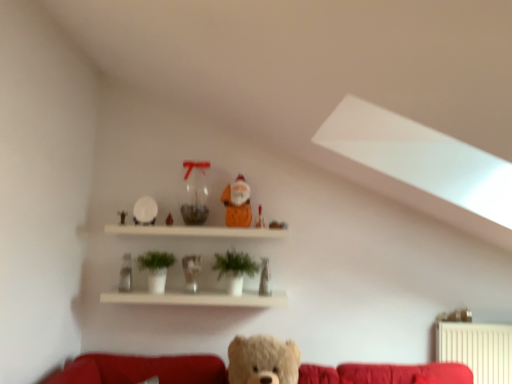
Question: Is translucent glass figurine at center, which ranks as the first figurine in left-to-right order, at the back of green matte plant at center?

Choices:
 (A) yes
 (B) no

Answer: (B)

Question: Is green matte plant at center not within translucent glass figurine at center, which ranks as the first figurine in left-to-right order?

Choices:
 (A) no
 (B) yes

Answer: (B)

Question: Is green matte plant at center smaller than translucent glass figurine at center, which ranks as the first figurine in left-to-right order?

Choices:
 (A) yes
 (B) no

Answer: (B)

Question: Could you tell me if green matte plant at center is facing translucent glass figurine at center, which ranks as the first figurine in left-to-right order?

Choices:
 (A) no
 (B) yes

Answer: (A)

Question: From a real-world perspective, is green matte plant at center below translucent glass figurine at center, which ranks as the first figurine in left-to-right order?

Choices:
 (A) no
 (B) yes

Answer: (A)

Question: Looking at the image, does translucent glass figurine at center, which ranks as the first figurine in left-to-right order, seem bigger or smaller compared to matte orange santa at upper center, the second toy positioned from the right?

Choices:
 (A) small
 (B) big

Answer: (B)

Question: Considering their positions, is translucent glass figurine at center, which ranks as the first figurine in left-to-right order, located in front of or behind matte orange santa at upper center, the second toy positioned from the right?

Choices:
 (A) behind
 (B) front

Answer: (B)

Question: Is translucent glass figurine at center, the second figurine from the right, taller or shorter than matte orange santa at upper center, the second toy positioned from the right?

Choices:
 (A) short
 (B) tall

Answer: (B)

Question: Is translucent glass figurine at center, the second figurine from the right, to the left or to the right of matte orange santa at upper center, the 4th toy viewed from the left, in the image?

Choices:
 (A) right
 (B) left

Answer: (B)

Question: From a real-world perspective, relative to matte orange santa at upper center, the 1th toy viewed from the right, is translucent glass figurine at center, the second figurine from the right, vertically above or below?

Choices:
 (A) above
 (B) below

Answer: (B)

Question: From the image's perspective, is translucent glass figurine at center, which ranks as the first figurine in left-to-right order, located above or below matte orange santa at upper center, the 5th toy viewed from the left?

Choices:
 (A) above
 (B) below

Answer: (B)

Question: Is translucent glass figurine at center, which ranks as the first figurine in left-to-right order, in front of or behind matte orange santa at upper center, the 5th toy viewed from the left, in the image?

Choices:
 (A) front
 (B) behind

Answer: (A)

Question: In the image, is translucent glass figurine at center, the second figurine from the right, on the left side or the right side of matte orange santa at upper center, the 1th toy viewed from the right?

Choices:
 (A) right
 (B) left

Answer: (B)

Question: Considering the positions of green matte plant at center and matte orange santa at upper center, marked as the third toy in a right-to-left arrangement, in the image, is green matte plant at center taller or shorter than matte orange santa at upper center, marked as the third toy in a right-to-left arrangement,?

Choices:
 (A) tall
 (B) short

Answer: (B)

Question: Relative to matte orange santa at upper center, the third toy from the left, is green matte plant at center in front or behind?

Choices:
 (A) behind
 (B) front

Answer: (B)